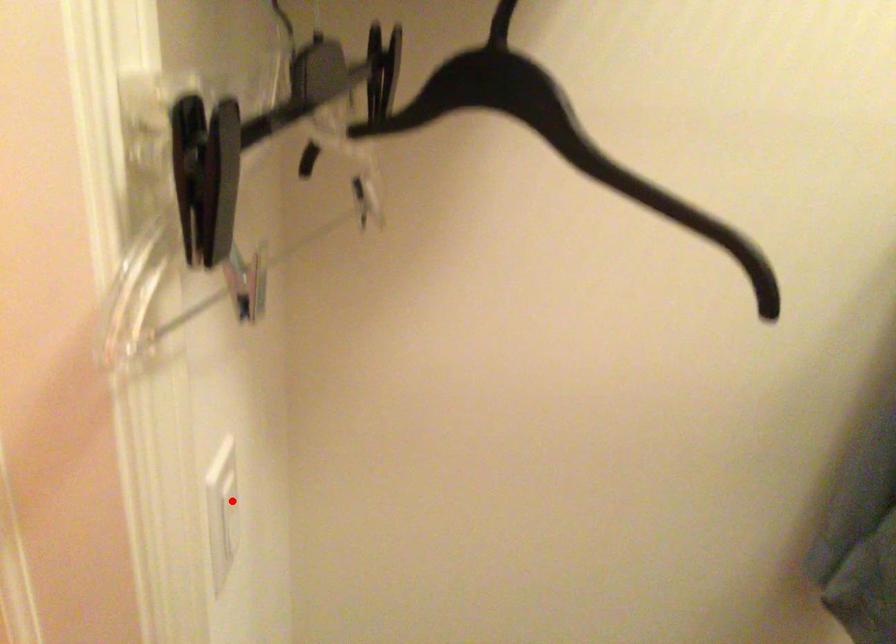
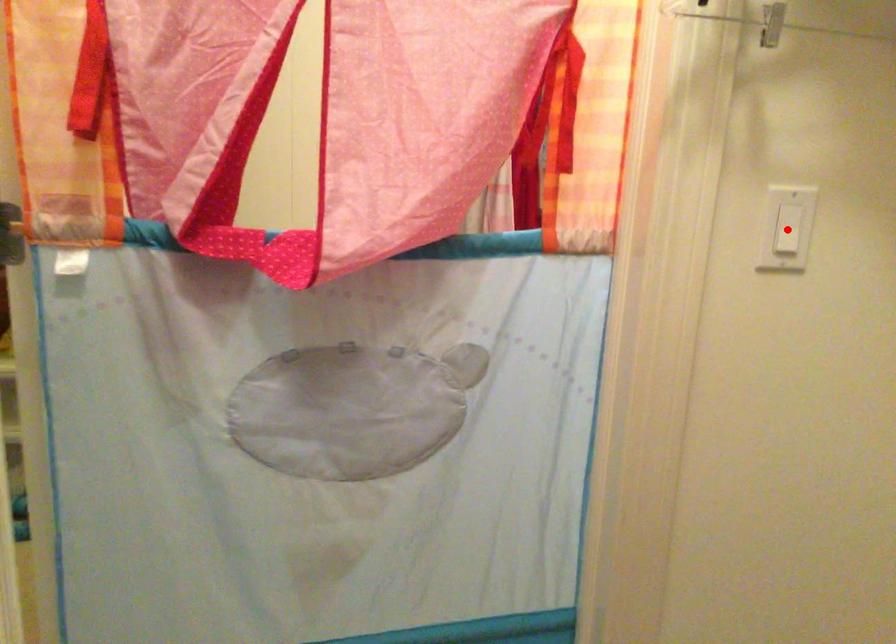
I am providing you with two images of the same scene from different viewpoints. A red point is marked on the first image and another point is marked on the second image. Is the marked point in image1 the same physical position as the marked point in image2?

Yes